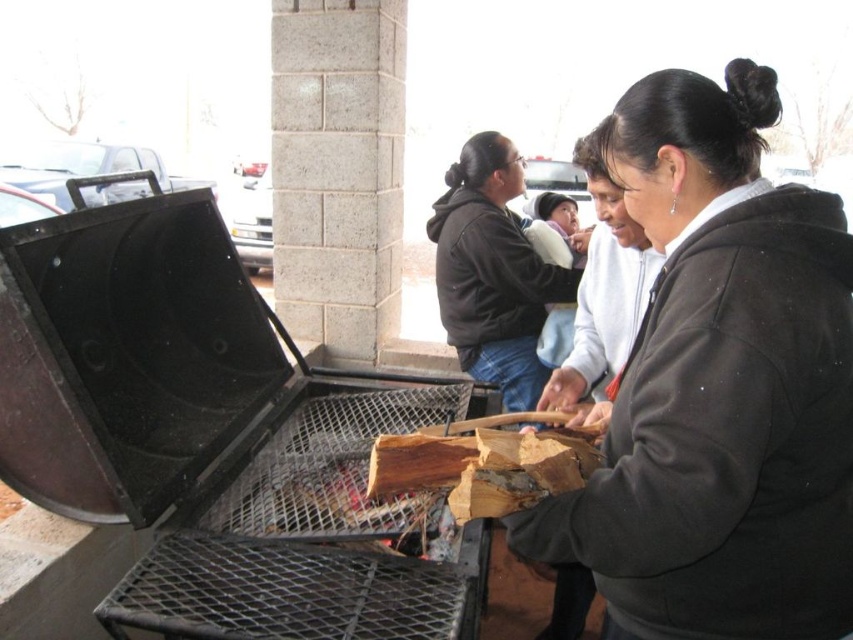
Who is lower down, dark gray fleece jacket at center or dark brown hoodie at center?

dark gray fleece jacket at center

Can you confirm if dark gray fleece jacket at center is wider than dark brown hoodie at center?

No.

Who is more forward, (724, 454) or (456, 188)?

Point (724, 454) is in front.

This screenshot has width=853, height=640. I want to click on dark gray fleece jacket at center, so click(x=718, y=385).

Can you confirm if black matte grill at left is positioned above dark brown hoodie at center?

No.

Can you confirm if black matte grill at left is positioned to the left of dark brown hoodie at center?

Yes, black matte grill at left is to the left of dark brown hoodie at center.

Where is `black matte grill at left`? This screenshot has height=640, width=853. black matte grill at left is located at coordinates (190, 428).

Is dark gray fleece jacket at center above black matte grill at left?

Yes.

Is point (851, 490) closer to camera compared to point (213, 396)?

Yes, it is.

This screenshot has width=853, height=640. I want to click on dark gray fleece jacket at center, so click(x=718, y=385).